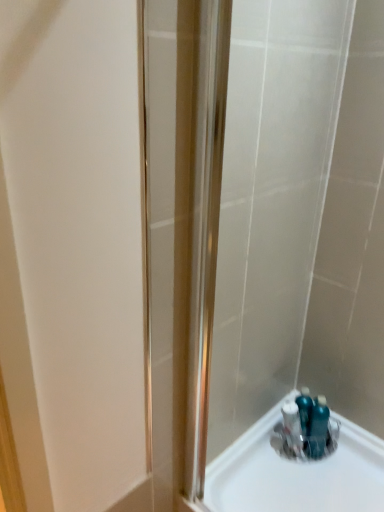
Question: Can you confirm if satin nickel shower door at center is positioned to the right of clear plastic container at bottom right, the first sink viewed from the left?

Choices:
 (A) yes
 (B) no

Answer: (B)

Question: Is satin nickel shower door at center further to the viewer compared to clear plastic container at bottom right, the first sink viewed from the left?

Choices:
 (A) yes
 (B) no

Answer: (B)

Question: Is satin nickel shower door at center located outside clear plastic container at bottom right, which ranks as the second sink in right-to-left order?

Choices:
 (A) no
 (B) yes

Answer: (B)

Question: Is satin nickel shower door at center thinner than clear plastic container at bottom right, the first sink viewed from the left?

Choices:
 (A) no
 (B) yes

Answer: (B)

Question: Is clear plastic container at bottom right, the first sink viewed from the left, located within satin nickel shower door at center?

Choices:
 (A) yes
 (B) no

Answer: (B)

Question: Can you confirm if satin nickel shower door at center is taller than clear plastic container at bottom right, which ranks as the second sink in right-to-left order?

Choices:
 (A) yes
 (B) no

Answer: (A)

Question: Considering the relative sizes of clear plastic container at bottom right, which ranks as the second sink in right-to-left order, and blue glossy bottles at bottom right, which is the first sink from right to left, in the image provided, is clear plastic container at bottom right, which ranks as the second sink in right-to-left order, smaller than blue glossy bottles at bottom right, which is the first sink from right to left,?

Choices:
 (A) yes
 (B) no

Answer: (B)

Question: Does clear plastic container at bottom right, which ranks as the second sink in right-to-left order, have a greater width compared to blue glossy bottles at bottom right, the 2th sink in the left-to-right sequence?

Choices:
 (A) yes
 (B) no

Answer: (A)

Question: Is clear plastic container at bottom right, which ranks as the second sink in right-to-left order, oriented towards blue glossy bottles at bottom right, the 2th sink in the left-to-right sequence?

Choices:
 (A) yes
 (B) no

Answer: (B)

Question: Could blue glossy bottles at bottom right, the 2th sink in the left-to-right sequence, be considered to be inside clear plastic container at bottom right, which ranks as the second sink in right-to-left order?

Choices:
 (A) yes
 (B) no

Answer: (B)

Question: From a real-world perspective, is clear plastic container at bottom right, which ranks as the second sink in right-to-left order, physically below blue glossy bottles at bottom right, the 2th sink in the left-to-right sequence?

Choices:
 (A) yes
 (B) no

Answer: (A)

Question: Can you confirm if clear plastic container at bottom right, which ranks as the second sink in right-to-left order, is thinner than blue glossy bottles at bottom right, which is the first sink from right to left?

Choices:
 (A) yes
 (B) no

Answer: (B)

Question: Does satin nickel shower door at center have a lesser width compared to blue glossy bottles at bottom right, which is the first sink from right to left?

Choices:
 (A) yes
 (B) no

Answer: (B)